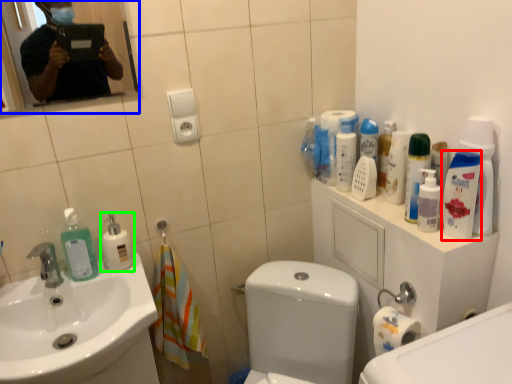
Question: Considering the real-world distances, which object is closest to mouthwash (highlighted by a red box)? mirror (highlighted by a blue box) or cleaning product (highlighted by a green box).

Choices:
 (A) mirror
 (B) cleaning product

Answer: (B)